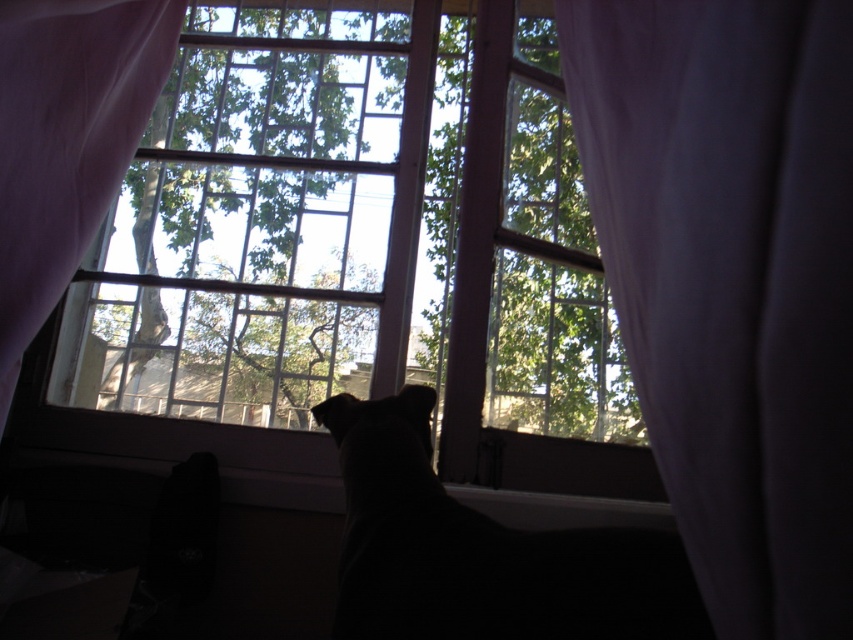
Question: Estimate the real-world distances between objects in this image. Which object is closer to the white sheer curtain at left?

Choices:
 (A) black fur cat at center
 (B) white sheer curtain at right
 (C) clear glass window at center

Answer: (A)

Question: Where is clear glass window at center located in relation to black fur cat at center in the image?

Choices:
 (A) below
 (B) above

Answer: (B)

Question: Which of the following is the farthest from the observer?

Choices:
 (A) black fur cat at center
 (B) white sheer curtain at right

Answer: (A)

Question: Observing the image, what is the correct spatial positioning of white sheer curtain at right in reference to black fur cat at center?

Choices:
 (A) above
 (B) below

Answer: (A)

Question: Which of the following is the closest to the observer?

Choices:
 (A) (445, 372)
 (B) (86, 28)

Answer: (B)

Question: Can you confirm if white sheer curtain at right is positioned to the right of white sheer curtain at left?

Choices:
 (A) no
 (B) yes

Answer: (B)